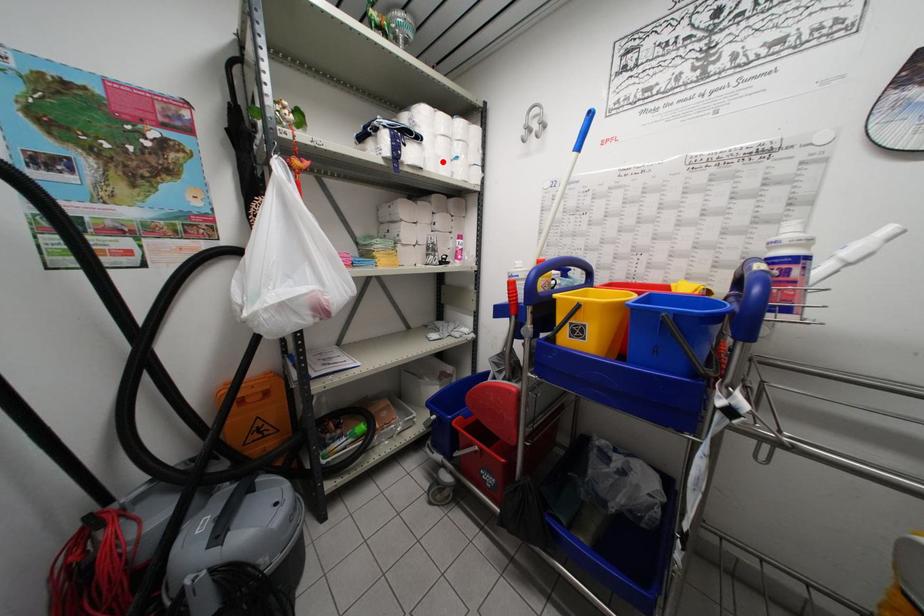
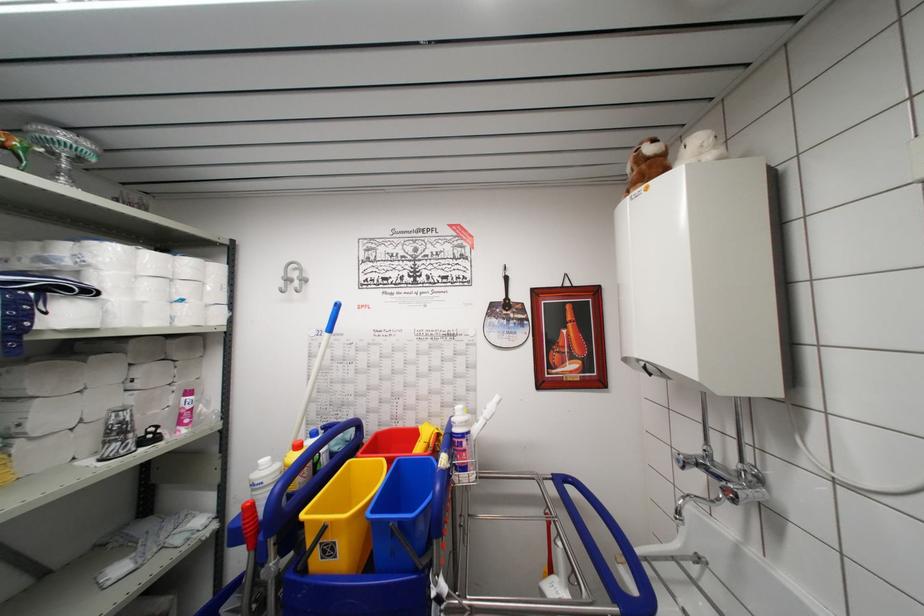
Locate, in the second image, the point that corresponds to the highlighted location in the first image.

(149, 307)